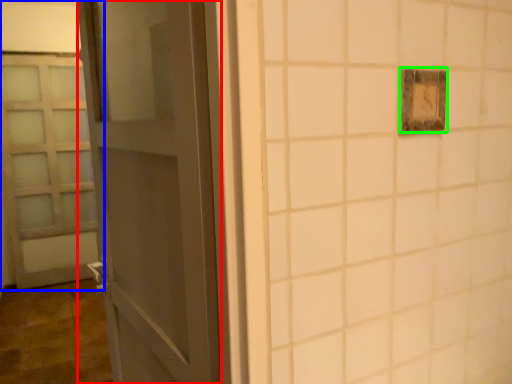
Question: Based on their relative distances, which object is nearer to door (highlighted by a red box)? Choose from door (highlighted by a blue box) and light switch (highlighted by a green box).

Choices:
 (A) door
 (B) light switch

Answer: (B)